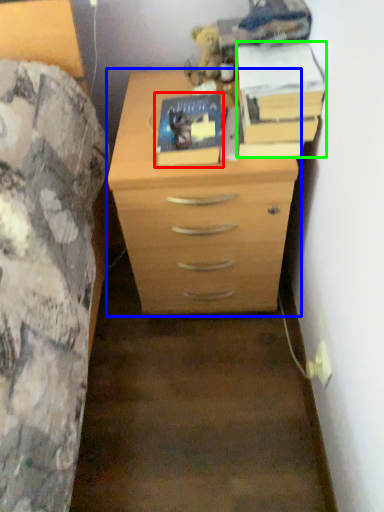
Question: Based on their relative distances, which object is nearer to paperback book (highlighted by a red box)? Choose from chest of drawers (highlighted by a blue box) and paperback book (highlighted by a green box).

Choices:
 (A) chest of drawers
 (B) paperback book

Answer: (B)